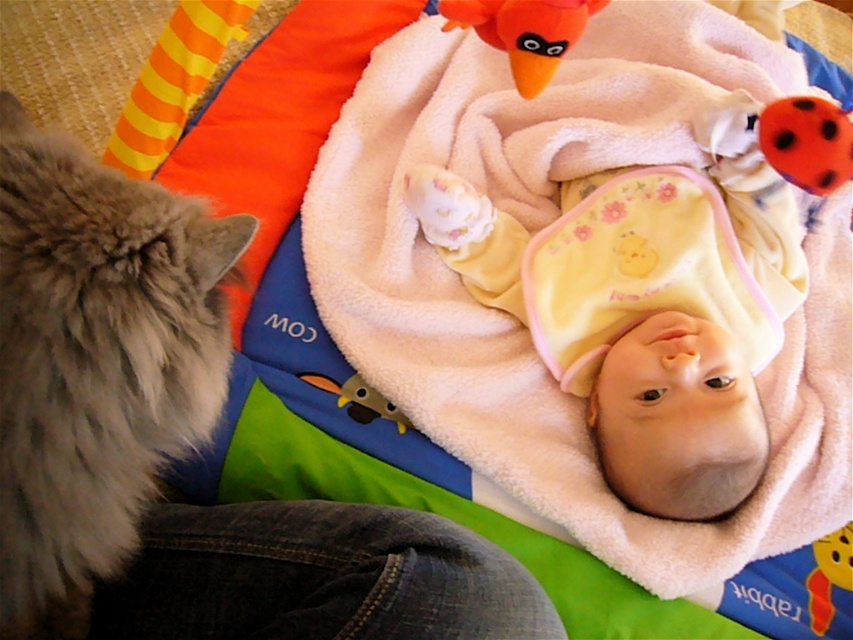
Who is positioned more to the left, fuzzy gray cat at left or fuzzy yellow duckling at center?

fuzzy gray cat at left is more to the left.

Between point (169, 326) and point (350, 381), which one is positioned in front?

Point (169, 326) is in front.

Find the location of a particular element. This screenshot has height=640, width=853. fuzzy gray cat at left is located at coordinates (96, 364).

The image size is (853, 640). What are the coordinates of `orange matte ladybug at upper right` in the screenshot? It's located at (807, 141).

Which is behind, point (775, 132) or point (822, 604)?

The point (822, 604) is more distant.

Is point (764, 147) behind point (838, 564)?

No, (764, 147) is closer to viewer.

In order to click on orange matte ladybug at upper right in this screenshot , I will do `click(807, 141)`.

Between point (775, 314) and point (518, 49), which one is positioned in front?

Point (518, 49)

Based on the photo, how much distance is there between yellow fleece baby at center and orange plush bird at upper center?

33.87 centimeters

This screenshot has width=853, height=640. Identify the location of yellow fleece baby at center. (660, 310).

Locate an element on the screen. yellow fleece baby at center is located at coordinates [660, 310].